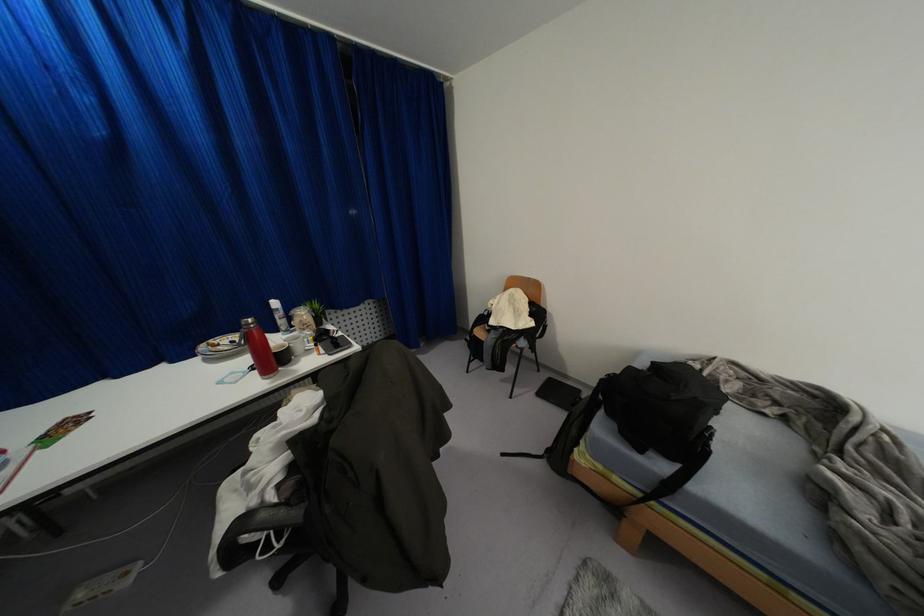
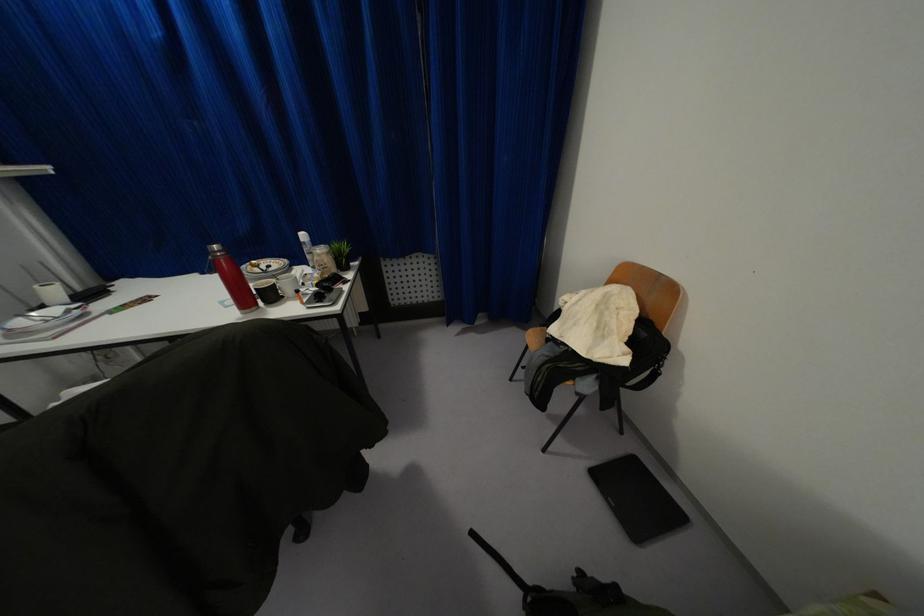
Where in the second image is the point corresponding to (x=249, y=320) from the first image?

(214, 246)